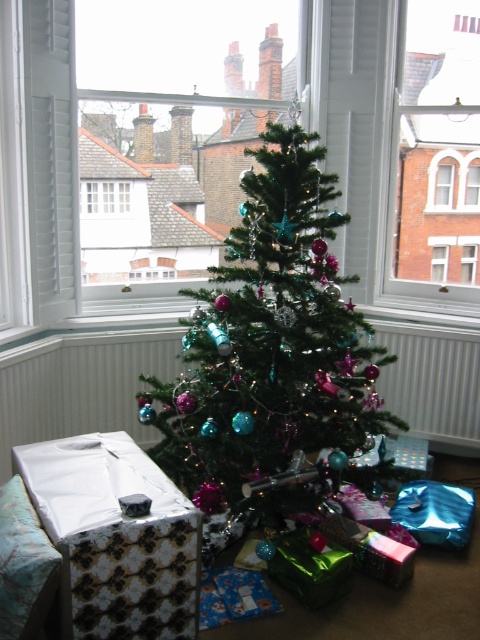
Looking at this image, you are planning to place a new rectangular table in the room. The table requires at least 1 meter of space on all sides to be safely positioned. Given the presence of the green shiny christmas tree at center and the green matte christmas tree at center, can you determine if there is enough space for the table?

The green shiny christmas tree at center might be wider than green matte christmas tree at center, so it is uncertain if there is enough space for the table. You should measure the exact width of both trees to confirm.

Based on the photo, you are planning to place a new rectangular shelf in the room. The shelf is as wide as the white wooden window at upper left. Can the shelf fit horizontally next to the green matte christmas tree at center without overlapping?

The green matte christmas tree at center is wider than the white wooden window at upper left. Since the shelf is as wide as the window, there should be enough space next to the tree to place the shelf horizontally without overlapping, as the tree itself is wider but the shelf width is narrower than the tree.